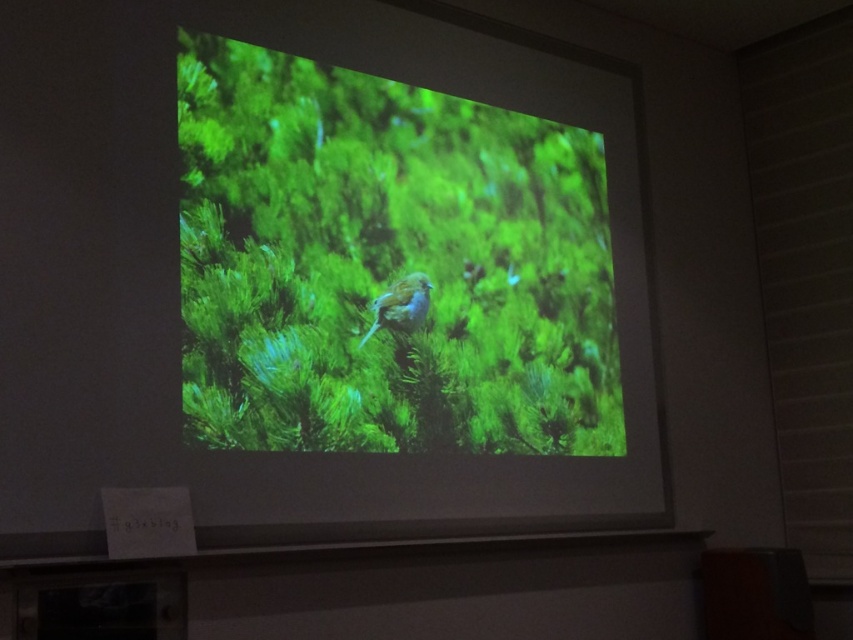
Question: Does green leafy plant at center have a smaller size compared to blue feathered bird at center?

Choices:
 (A) yes
 (B) no

Answer: (B)

Question: Which point is closer to the camera?

Choices:
 (A) 403,294
 (B) 192,115

Answer: (B)

Question: Which point appears closest to the camera in this image?

Choices:
 (A) (387, 305)
 (B) (341, 364)

Answer: (B)

Question: Does green leafy plant at center have a greater width compared to blue feathered bird at center?

Choices:
 (A) no
 (B) yes

Answer: (B)

Question: Can you confirm if green leafy plant at center is thinner than blue feathered bird at center?

Choices:
 (A) yes
 (B) no

Answer: (B)